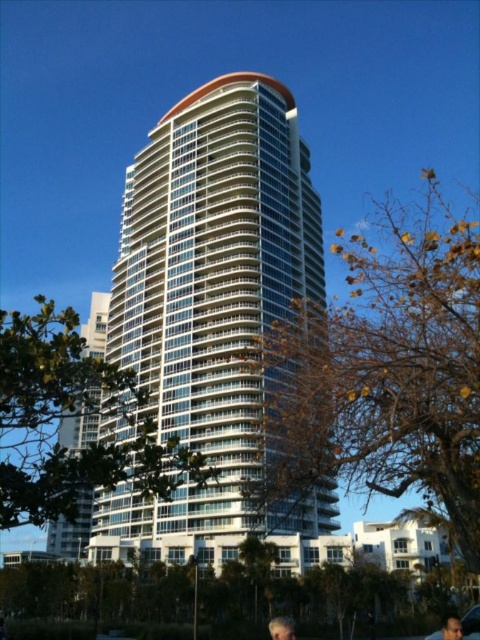
Which is behind, point (230, 179) or point (63, 420)?

The point (63, 420) is behind.

Between point (179, 216) and point (93, 323), which one is positioned in front?

Point (179, 216) is more forward.

Find the location of a particular element. The image size is (480, 640). white glass building at center is located at coordinates (212, 310).

Based on the photo, can you confirm if white glass building at left is positioned to the left of smooth skin face at lower right?

Indeed, white glass building at left is positioned on the left side of smooth skin face at lower right.

Which of these two, white glass building at left or smooth skin face at lower right, stands taller?

Standing taller between the two is white glass building at left.

Is point (61, 440) closer to viewer compared to point (465, 637)?

No, it is not.

Find the location of a particular element. The width and height of the screenshot is (480, 640). white glass building at left is located at coordinates (71, 531).

Is white glass building at center below smooth skin face at lower right?

Actually, white glass building at center is above smooth skin face at lower right.

Does white glass building at center appear on the right side of smooth skin face at lower right?

In fact, white glass building at center is to the left of smooth skin face at lower right.

Does point (172, 337) lie in front of point (432, 634)?

No, (172, 337) is further to viewer.

Identify the location of white glass building at center. The width and height of the screenshot is (480, 640). (212, 310).